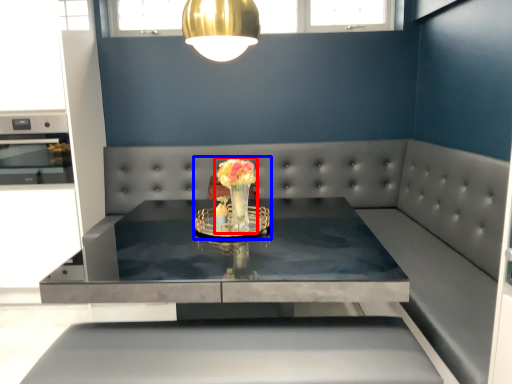
Question: Among these objects, which one is nearest to the camera, floral arrangement (highlighted by a red box) or floral arrangement (highlighted by a blue box)?

Choices:
 (A) floral arrangement
 (B) floral arrangement

Answer: (A)